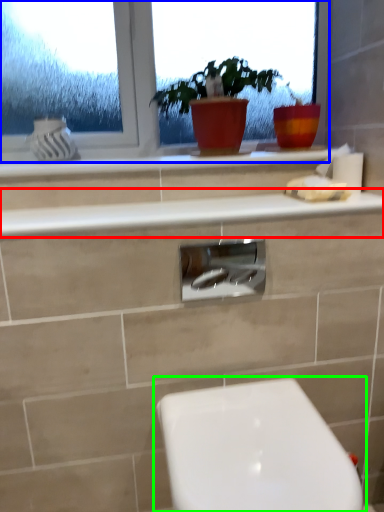
Question: Which object is positioned closest to counter top (highlighted by a red box)? Select from window (highlighted by a blue box) and toilet (highlighted by a green box).

Choices:
 (A) window
 (B) toilet

Answer: (A)